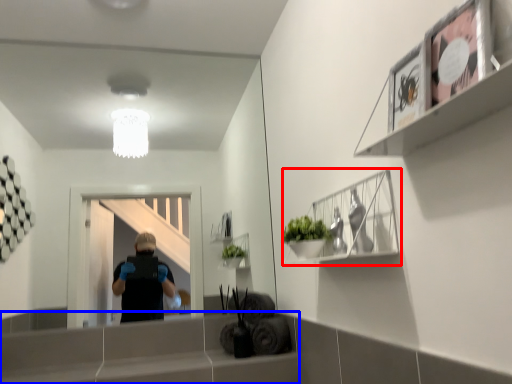
Question: Which point is closer to the camera, cabinet (highlighted by a red box) or ledge (highlighted by a blue box)?

Choices:
 (A) cabinet
 (B) ledge

Answer: (A)